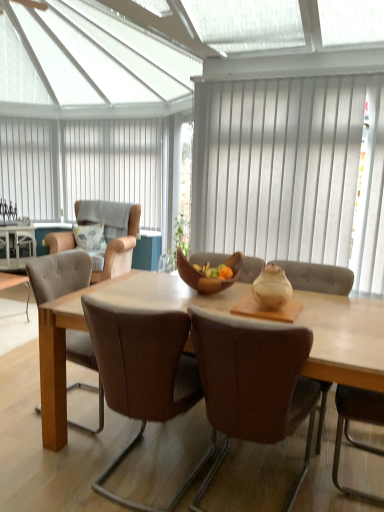
Question: Should I look upward or downward to see brown leather chair at center, which is counted as the third chair, starting from the back?

Choices:
 (A) down
 (B) up

Answer: (A)

Question: Is brown leather chair at center, arranged as the 4th chair when viewed from the back, aimed at brown leather chair at center, which is counted as the third chair, starting from the back?

Choices:
 (A) yes
 (B) no

Answer: (B)

Question: Can you confirm if brown leather chair at center, arranged as the 4th chair when viewed from the back, is wider than brown leather chair at center, which is the second chair from front to back?

Choices:
 (A) no
 (B) yes

Answer: (A)

Question: Considering the relative positions of brown leather chair at center, which is the first chair in front-to-back order, and brown leather chair at center, which is counted as the third chair, starting from the back, in the image provided, is brown leather chair at center, which is the first chair in front-to-back order, to the left of brown leather chair at center, which is counted as the third chair, starting from the back, from the viewer's perspective?

Choices:
 (A) yes
 (B) no

Answer: (B)

Question: Does brown leather chair at center, which is the first chair in front-to-back order, appear on the right side of brown leather chair at center, which is the second chair from front to back?

Choices:
 (A) yes
 (B) no

Answer: (A)

Question: Does brown leather chair at center, arranged as the 4th chair when viewed from the back, have a lesser width compared to brown leather chair at center, which is counted as the third chair, starting from the back?

Choices:
 (A) yes
 (B) no

Answer: (A)

Question: Is brown leather chair at center, arranged as the 4th chair when viewed from the back, facing away from brown leather chair at center, which is the second chair from front to back?

Choices:
 (A) yes
 (B) no

Answer: (B)

Question: From the image's perspective, is white textured curtain at center, the second curtain viewed from the left, above brown leather table at lower left?

Choices:
 (A) yes
 (B) no

Answer: (A)

Question: Is white textured curtain at center, positioned as the first curtain in right-to-left order, smaller than brown leather table at lower left?

Choices:
 (A) yes
 (B) no

Answer: (A)

Question: Does white textured curtain at center, positioned as the 2th curtain in back-to-front order, appear on the right side of brown leather table at lower left?

Choices:
 (A) no
 (B) yes

Answer: (B)

Question: Can you confirm if white textured curtain at center, placed as the first curtain when sorted from front to back, is taller than brown leather table at lower left?

Choices:
 (A) yes
 (B) no

Answer: (A)

Question: Does white textured curtain at center, positioned as the 2th curtain in back-to-front order, lie behind brown leather table at lower left?

Choices:
 (A) yes
 (B) no

Answer: (B)

Question: Is white textured curtain at center, positioned as the first curtain in right-to-left order, next to brown leather table at lower left and touching it?

Choices:
 (A) yes
 (B) no

Answer: (B)

Question: Can you confirm if brown leather chair at left, the 2th chair in the back-to-front sequence, is positioned to the left of beige fabric armchair at left, which ranks as the 4th chair in front-to-back order?

Choices:
 (A) no
 (B) yes

Answer: (A)